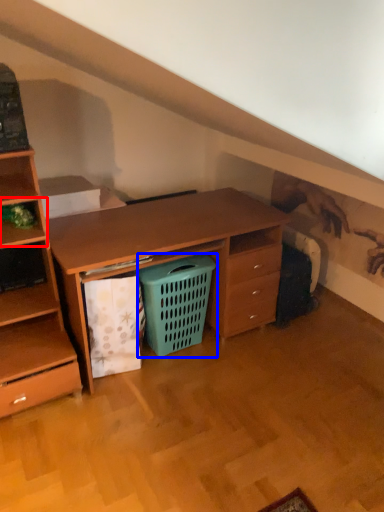
Question: Which object appears farthest to the camera in this image, shelf (highlighted by a red box) or shopping basket (highlighted by a blue box)?

Choices:
 (A) shelf
 (B) shopping basket

Answer: (B)